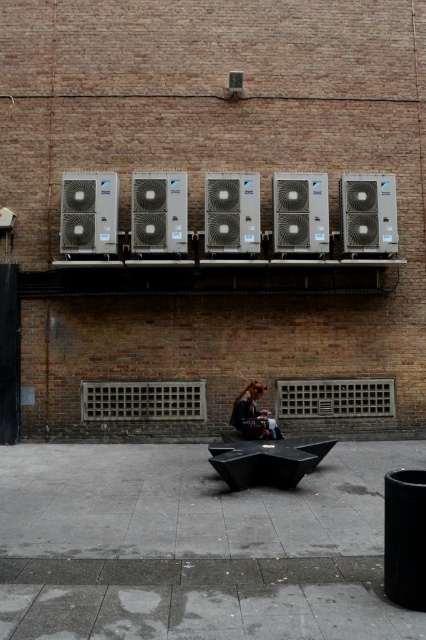
You are standing in front of the brick wall with the air conditioning units and vents. There are two points marked on the wall. Which point is closer to you, point (60, 236) or point (287, 246)?

Point (60, 236) is closer to you because it is further to the viewer than point (287, 246).

You are a maintenance worker inspecting the wall. You notice two air conditioners labeled as silver metallic air conditioner at upper center and silver metallic air conditioner at center. Which one is located below the other?

The silver metallic air conditioner at upper center is positioned under the silver metallic air conditioner at center, meaning the one at center is above and the one at upper center is below.

You are standing in front of the brick wall and want to locate the matte silver air conditioner at upper left. What are the coordinates of its position?

The matte silver air conditioner at upper left is located at coordinates point (89,212).